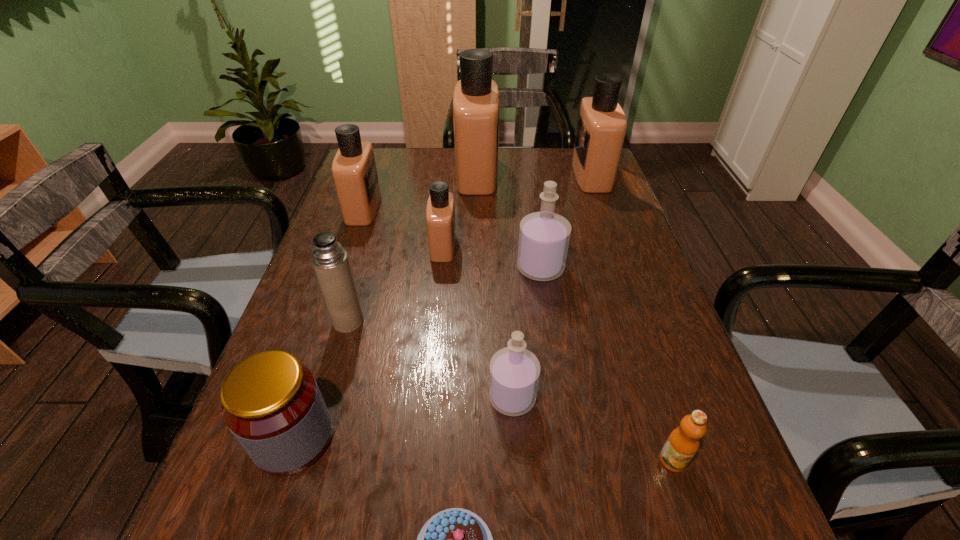
At what (x,y) coordinates should I click in order to perform the action: click on vacant space situated 0.130m on the front label of the nearest beige perfume. Please return your answer as a coordinate pair (x, y). Image resolution: width=960 pixels, height=540 pixels. Looking at the image, I should click on (506, 246).

This screenshot has width=960, height=540. I want to click on free space located on the back of the smaller purple perfume, so click(x=508, y=322).

Locate an element on the screen. vacant point located 0.150m on the right of the red jar is located at coordinates (420, 438).

Identify the location of vacant position located 0.090m on the front label of the orange juice. (697, 534).

Locate an element on the screen. perfume located at the left edge is located at coordinates (354, 171).

The image size is (960, 540). I want to click on thermos bottle that is at the left edge, so click(330, 261).

Image resolution: width=960 pixels, height=540 pixels. Identify the location of jar positioned at the left edge. (271, 403).

Where is `perfume at the right edge`? Image resolution: width=960 pixels, height=540 pixels. perfume at the right edge is located at coordinates click(601, 128).

In order to click on orange juice situated at the right edge in this screenshot , I will do `click(683, 442)`.

Where is `object present at the far right corner`? Image resolution: width=960 pixels, height=540 pixels. object present at the far right corner is located at coordinates (601, 128).